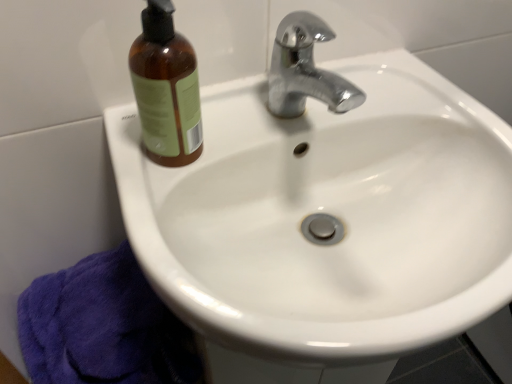
Question: Can you confirm if brown glass bottle at upper left is positioned to the right of purple terry cloth towel at lower left?

Choices:
 (A) yes
 (B) no

Answer: (A)

Question: Does brown glass bottle at upper left appear on the left side of purple terry cloth towel at lower left?

Choices:
 (A) yes
 (B) no

Answer: (B)

Question: Is brown glass bottle at upper left positioned far away from purple terry cloth towel at lower left?

Choices:
 (A) yes
 (B) no

Answer: (B)

Question: Considering the relative sizes of brown glass bottle at upper left and purple terry cloth towel at lower left in the image provided, is brown glass bottle at upper left taller than purple terry cloth towel at lower left?

Choices:
 (A) yes
 (B) no

Answer: (B)

Question: Is brown glass bottle at upper left wider than purple terry cloth towel at lower left?

Choices:
 (A) yes
 (B) no

Answer: (B)

Question: Is brown glass bottle at upper left thinner than purple terry cloth towel at lower left?

Choices:
 (A) yes
 (B) no

Answer: (A)

Question: Could you tell me if purple terry cloth towel at lower left is turned towards brown glass bottle at upper left?

Choices:
 (A) no
 (B) yes

Answer: (A)

Question: Is purple terry cloth towel at lower left positioned with its back to brown glass bottle at upper left?

Choices:
 (A) yes
 (B) no

Answer: (B)

Question: Can we say purple terry cloth towel at lower left lies outside brown glass bottle at upper left?

Choices:
 (A) yes
 (B) no

Answer: (A)

Question: From a real-world perspective, is purple terry cloth towel at lower left positioned over brown glass bottle at upper left based on gravity?

Choices:
 (A) no
 (B) yes

Answer: (A)

Question: Considering the relative sizes of purple terry cloth towel at lower left and brown glass bottle at upper left in the image provided, is purple terry cloth towel at lower left thinner than brown glass bottle at upper left?

Choices:
 (A) yes
 (B) no

Answer: (B)

Question: Is purple terry cloth towel at lower left positioned behind brown glass bottle at upper left?

Choices:
 (A) yes
 (B) no

Answer: (A)

Question: Considering the positions of purple terry cloth towel at lower left and brown glass bottle at upper left in the image, is purple terry cloth towel at lower left wider or thinner than brown glass bottle at upper left?

Choices:
 (A) thin
 (B) wide

Answer: (B)